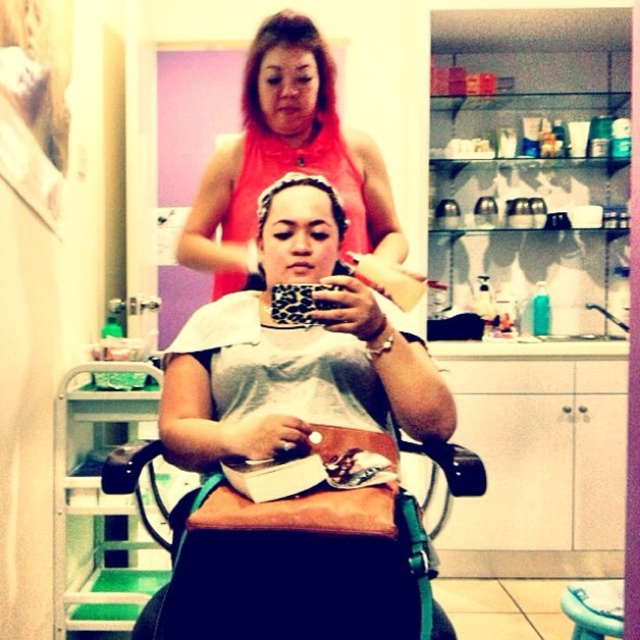
Is leather belt at center above pink matte tank top at upper center?

Incorrect, leather belt at center is not positioned above pink matte tank top at upper center.

Is leather belt at center further to camera compared to pink matte tank top at upper center?

No, leather belt at center is in front of pink matte tank top at upper center.

Find the location of a particular element. The width and height of the screenshot is (640, 640). leather belt at center is located at coordinates (294, 381).

Does brown shiny hair at upper center appear over wooden stool at lower right?

Yes, brown shiny hair at upper center is above wooden stool at lower right.

From the picture: Is brown shiny hair at upper center to the right of wooden stool at lower right from the viewer's perspective?

No, brown shiny hair at upper center is not to the right of wooden stool at lower right.

This screenshot has height=640, width=640. What do you see at coordinates (288, 45) in the screenshot?
I see `brown shiny hair at upper center` at bounding box center [288, 45].

You are a GUI agent. You are given a task and a screenshot of the screen. Output one action in this format:
    pyautogui.click(x=<x>, y=<y>)
    Task: Click on the brown shiny hair at upper center
    The height and width of the screenshot is (640, 640).
    Given the screenshot: What is the action you would take?
    pyautogui.click(x=288, y=45)

Can you confirm if leather belt at center is shorter than brown matte hair at center?

No.

The height and width of the screenshot is (640, 640). Find the location of `leather belt at center`. leather belt at center is located at coordinates (294, 381).